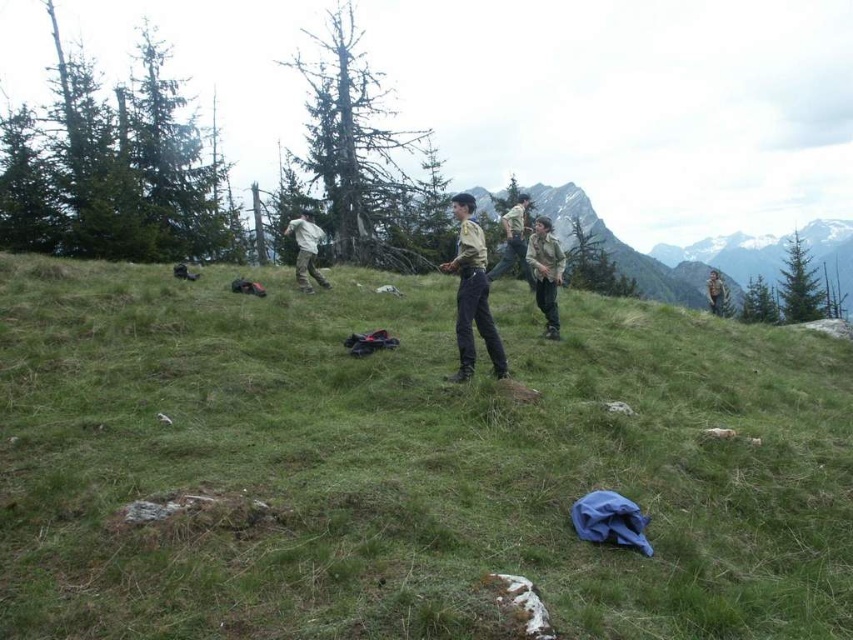
Is brown uniform at center below white matte pants at center?

Indeed, brown uniform at center is positioned under white matte pants at center.

Is brown uniform at center positioned behind white matte pants at center?

No.

Who is more distant from viewer, [471,314] or [300,220]?

The point [300,220] is behind.

Find the location of a particular element. The width and height of the screenshot is (853, 640). brown uniform at center is located at coordinates (x=473, y=292).

Is green grassy at center positioned before brown uniform at upper right?

Yes.

Which is more to the left, green grassy at center or brown uniform at upper right?

Positioned to the left is green grassy at center.

Is point (694, 531) positioned behind point (724, 294)?

No, (694, 531) is in front of (724, 294).

Where is `green grassy at center`? The height and width of the screenshot is (640, 853). green grassy at center is located at coordinates (405, 465).

Between point (531, 269) and point (306, 243), which one is positioned behind?

Positioned behind is point (531, 269).

At what (x,y) coordinates should I click in order to perform the action: click on green uniform at center. Please return your answer as a coordinate pair (x, y). Looking at the image, I should click on (544, 273).

This screenshot has width=853, height=640. I want to click on green uniform at center, so pyautogui.click(x=544, y=273).